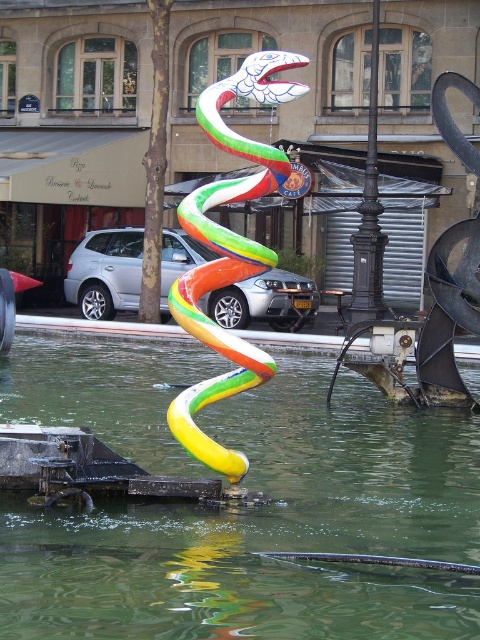
You are an artist trying to paint the sculpture of the multicolored glossy snake at center and the translucent green water at center. Based on the scene, which object is taller?

The multicolored glossy snake at center is taller than the translucent green water at center.

You are driving a car that is 5 meters long and need to park between the silver metallic suv at center and the black wrought iron pole at center. Is there enough space for your car to fit between them?

The silver metallic suv at center is 5.51 meters from the black wrought iron pole at center, so yes, the car can fit between them as the distance is greater than the car length.